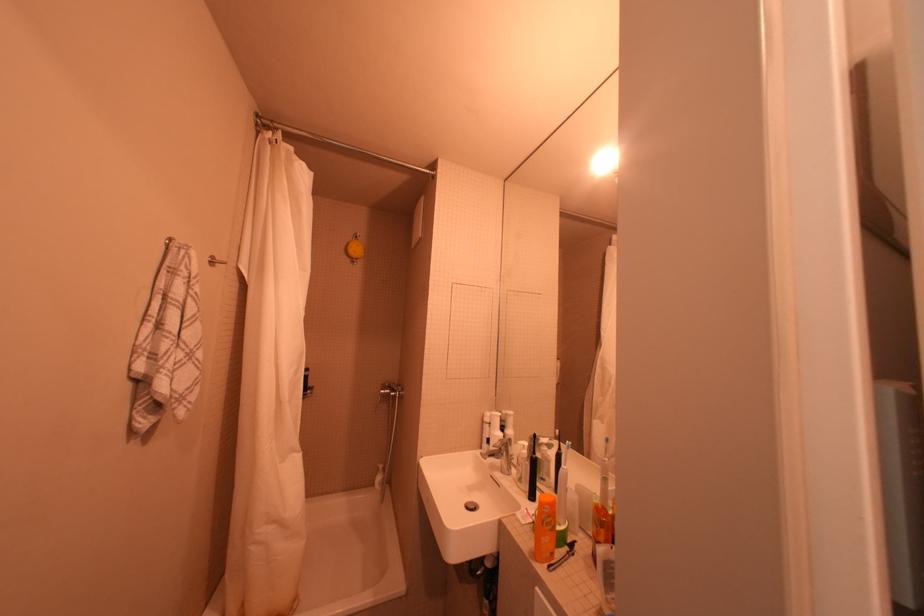
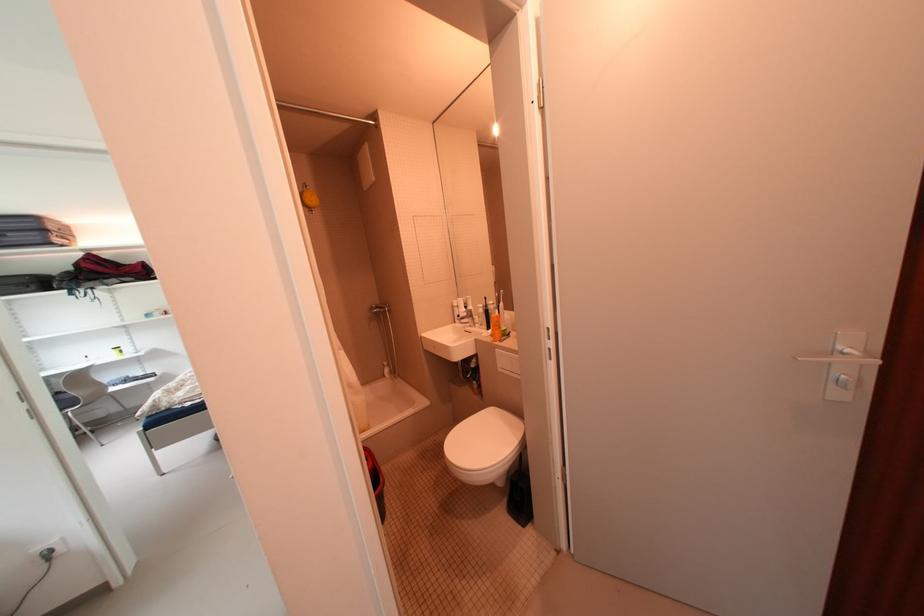
The point at (392, 469) is marked in the first image. Where is the corresponding point in the second image?

(396, 365)